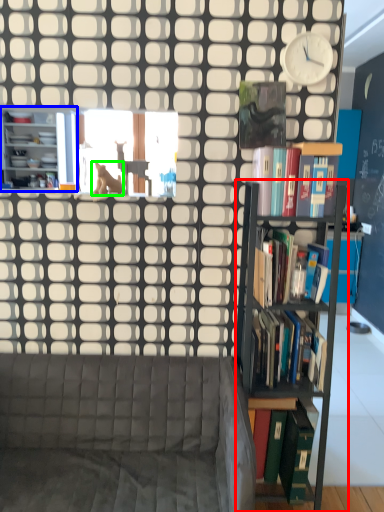
Question: Considering the real-world distances, which object is closest to shelf (highlighted by a red box)? bookcase (highlighted by a blue box) or animal (highlighted by a green box).

Choices:
 (A) bookcase
 (B) animal

Answer: (B)